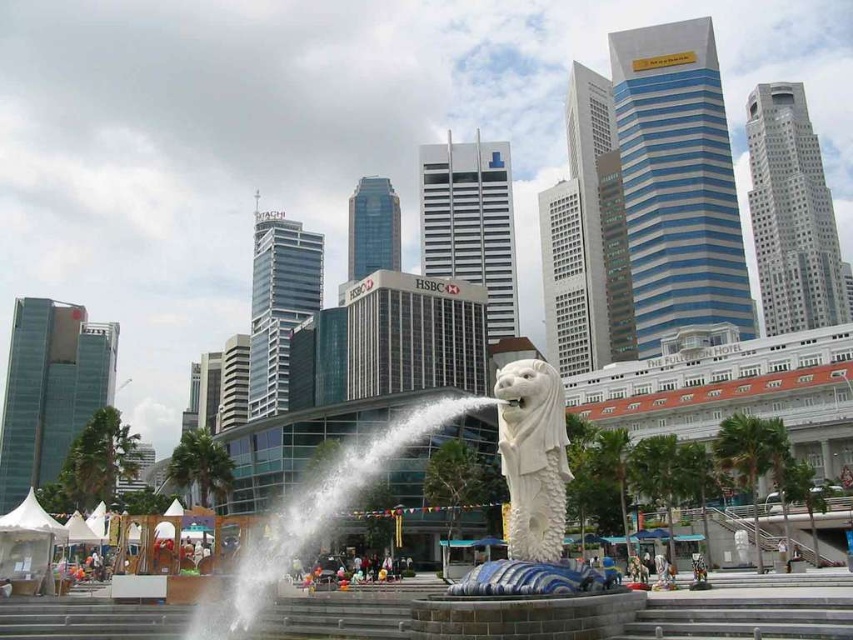
Question: Is white marble merlion at center above white water at center?

Choices:
 (A) no
 (B) yes

Answer: (B)

Question: Is white water at center below white stone merlion at center?

Choices:
 (A) no
 (B) yes

Answer: (B)

Question: Among these points, which one is nearest to the camera?

Choices:
 (A) (532, 374)
 (B) (496, 390)

Answer: (B)

Question: Is white marble merlion at center to the right of white stone merlion at center from the viewer's perspective?

Choices:
 (A) yes
 (B) no

Answer: (B)

Question: Which object is farther from the camera taking this photo?

Choices:
 (A) white marble merlion at center
 (B) white stone merlion at center
 (C) white water at center

Answer: (C)

Question: Estimate the real-world distances between objects in this image. Which object is closer to the white marble merlion at center?

Choices:
 (A) white water at center
 (B) white stone merlion at center

Answer: (B)